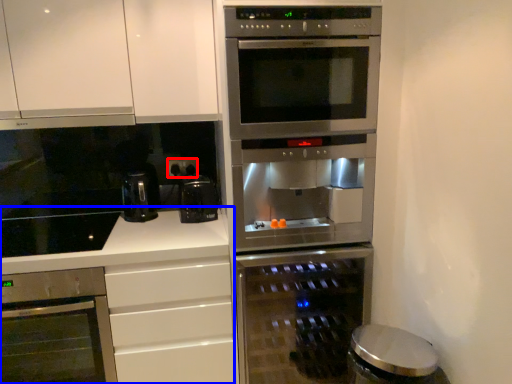
Question: Which object appears farthest to the camera in this image, electric outlet (highlighted by a red box) or counter (highlighted by a blue box)?

Choices:
 (A) electric outlet
 (B) counter

Answer: (A)